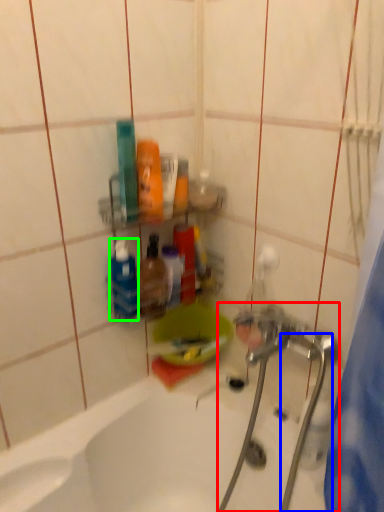
Question: Estimate the real-world distances between objects in this image. Which object is closer to plumbing fixture (highlighted by a red box), water pipe (highlighted by a blue box) or toiletry (highlighted by a green box)?

Choices:
 (A) water pipe
 (B) toiletry

Answer: (A)